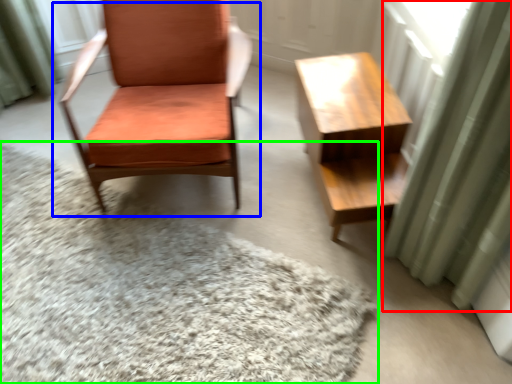
Question: Which object is the farthest from curtain (highlighted by a red box)? Choose among these: chair (highlighted by a blue box) or mat (highlighted by a green box).

Choices:
 (A) chair
 (B) mat

Answer: (A)